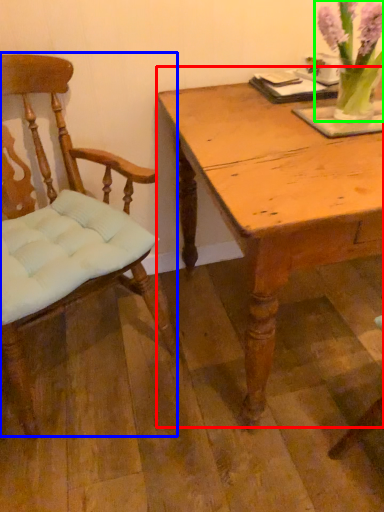
Question: Based on their relative distances, which object is farther from table (highlighted by a red box)? Choose from chair (highlighted by a blue box) and floral arrangement (highlighted by a green box).

Choices:
 (A) chair
 (B) floral arrangement

Answer: (A)